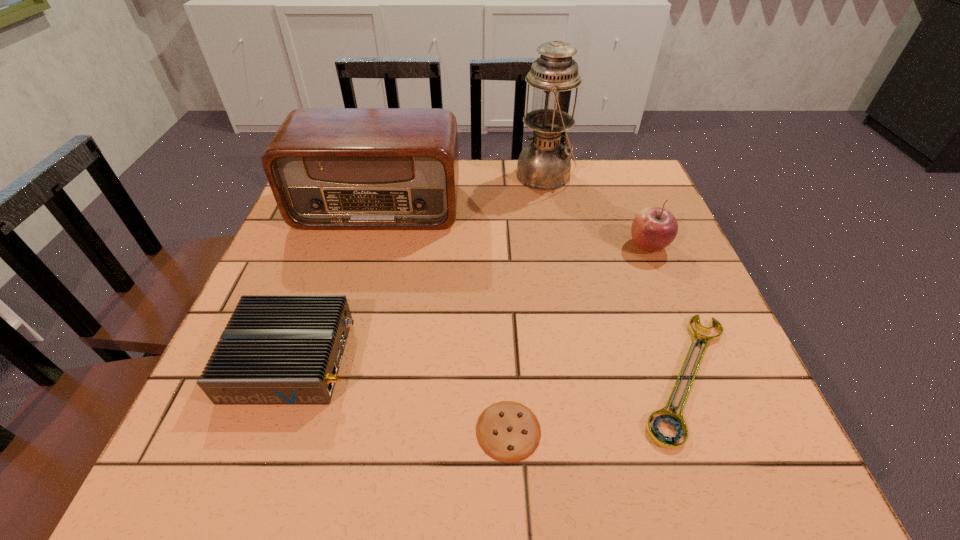
Locate an element on the screen. The width and height of the screenshot is (960, 540). free space located on the left of the fourth shortest object is located at coordinates (507, 246).

This screenshot has width=960, height=540. What are the coordinates of `vacant space located 0.380m on the back panel of the third shortest object` in the screenshot? It's located at (559, 359).

The image size is (960, 540). Find the location of `vacant space situated 0.400m on the back of the third object from left to right`. vacant space situated 0.400m on the back of the third object from left to right is located at coordinates (499, 246).

Locate an element on the screen. vacant space situated on the back of the wrench is located at coordinates (651, 282).

At what (x,y) coordinates should I click in order to perform the action: click on oil lamp present at the far edge. Please return your answer as a coordinate pair (x, y). Looking at the image, I should click on (544, 164).

You are a GUI agent. You are given a task and a screenshot of the screen. Output one action in this format:
    pyautogui.click(x=<x>, y=<y>)
    Task: Click on the radio receiver situated at the far edge
    This screenshot has height=540, width=960.
    Given the screenshot: What is the action you would take?
    pyautogui.click(x=328, y=168)

Where is `cookie present at the near edge`? cookie present at the near edge is located at coordinates (507, 431).

This screenshot has width=960, height=540. Identify the location of wrench situated at the near edge. (677, 421).

Identify the location of radio receiver at the left edge. (328, 168).

Image resolution: width=960 pixels, height=540 pixels. What are the coordinates of `router present at the left edge` in the screenshot? It's located at (276, 349).